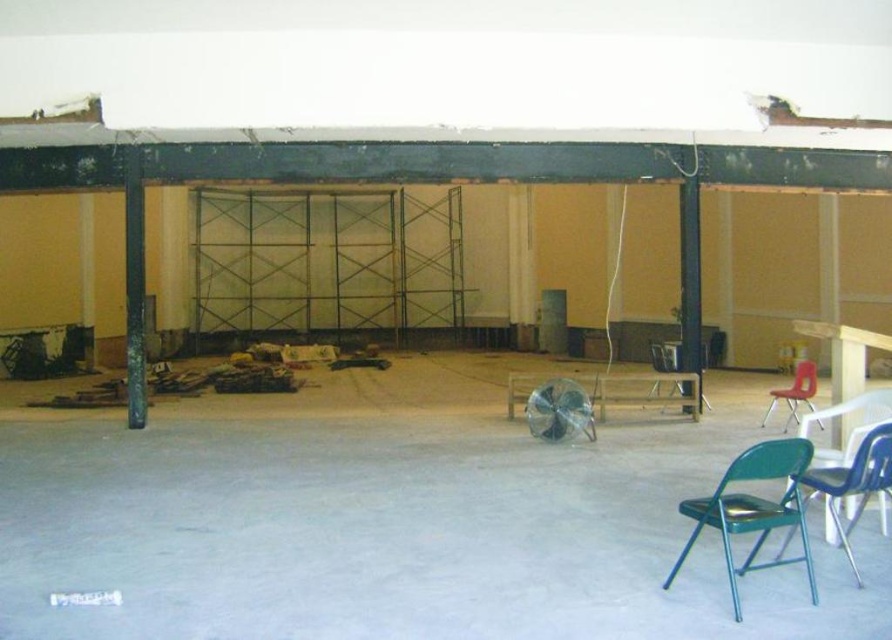
You are an inspector checking the construction site. You see the green metallic beam at left and the metallic silver chair at center. Which object is bigger in size?

The green metallic beam at left is larger in size compared to the metallic silver chair at center.